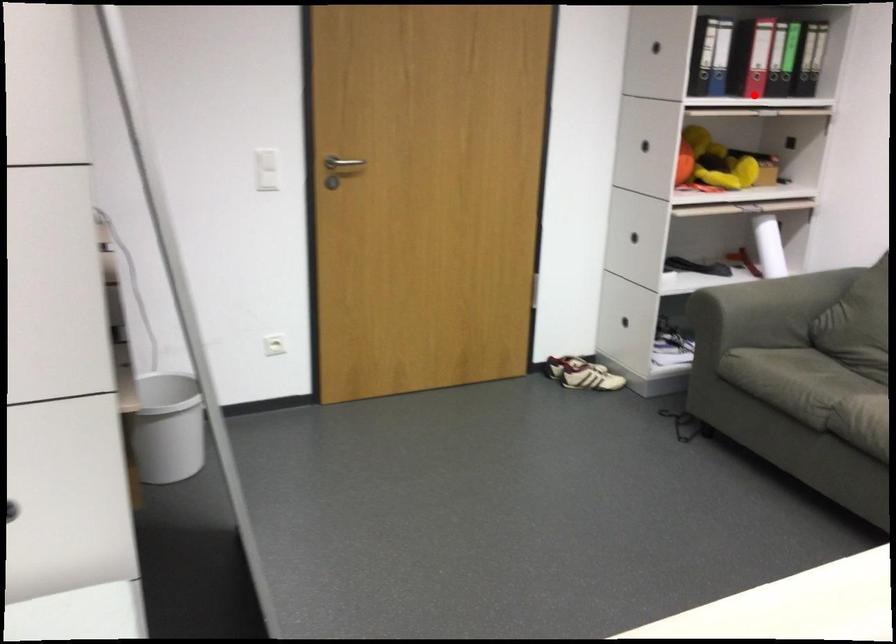
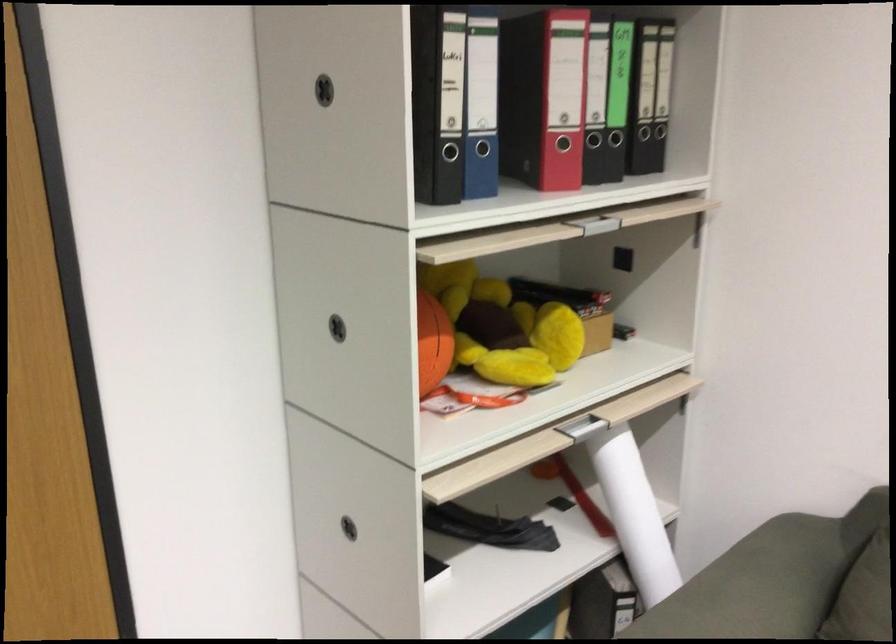
In the second image, find the point that corresponds to the highlighted location in the first image.

(573, 219)